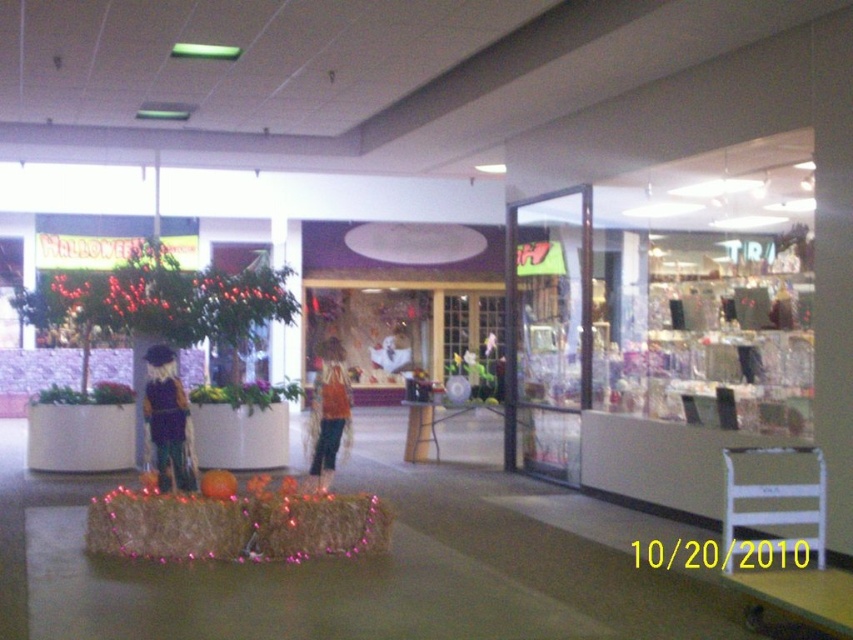
Is matte brown scarecrow at center closer to camera compared to orange fabric dress at center?

Yes.

Does matte brown scarecrow at center have a larger size compared to orange fabric dress at center?

Incorrect, matte brown scarecrow at center is not larger than orange fabric dress at center.

Identify the location of matte brown scarecrow at center. (167, 420).